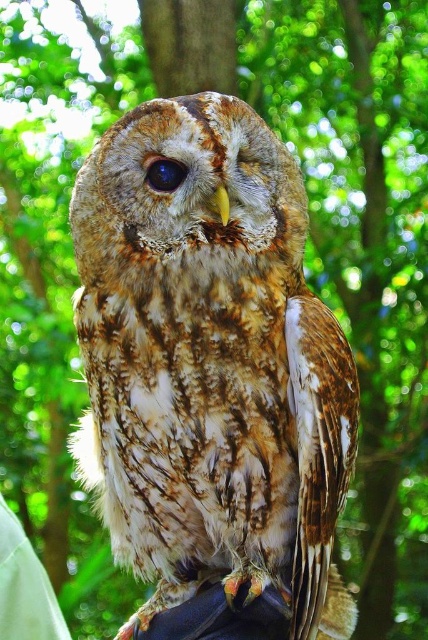
Question: Does white fabric at lower left appear over brown textured eye at center?

Choices:
 (A) yes
 (B) no

Answer: (B)

Question: Which point is farther to the camera?

Choices:
 (A) (214, 400)
 (B) (169, 184)
 (C) (23, 630)

Answer: (C)

Question: Which of the following is the farthest from the observer?

Choices:
 (A) white fabric at lower left
 (B) brown textured eye at center
 (C) brown speckled feathers at center

Answer: (A)

Question: Is brown speckled feathers at center thinner than white fabric at lower left?

Choices:
 (A) no
 (B) yes

Answer: (A)

Question: Is brown speckled feathers at center to the right of white fabric at lower left from the viewer's perspective?

Choices:
 (A) no
 (B) yes

Answer: (B)

Question: Which point appears closest to the camera in this image?

Choices:
 (A) (157, 168)
 (B) (17, 596)
 (C) (273, 266)

Answer: (A)